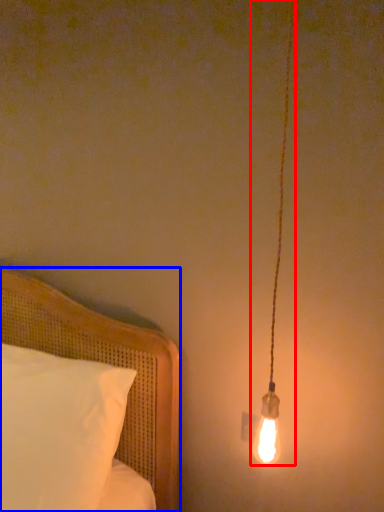
Question: Which object appears closest to the camera in this image, lamp (highlighted by a red box) or bed (highlighted by a blue box)?

Choices:
 (A) lamp
 (B) bed

Answer: (A)